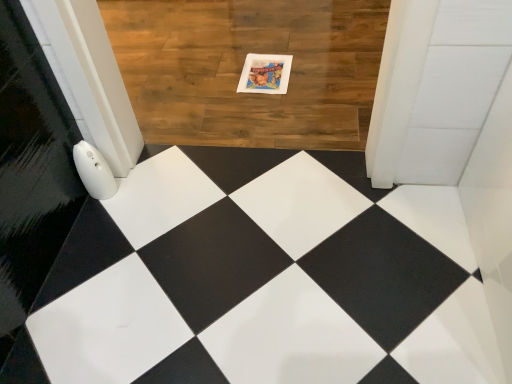
Question: Is point (381, 34) closer or farther from the camera than point (253, 72)?

Choices:
 (A) closer
 (B) farther

Answer: (B)

Question: Looking at the image, does wooden floor at center seem bigger or smaller compared to matte paper postcard at center?

Choices:
 (A) big
 (B) small

Answer: (A)

Question: Is wooden floor at center spatially inside matte paper postcard at center, or outside of it?

Choices:
 (A) inside
 (B) outside

Answer: (B)

Question: Is matte paper postcard at center bigger or smaller than wooden floor at center?

Choices:
 (A) small
 (B) big

Answer: (A)

Question: In terms of height, does matte paper postcard at center look taller or shorter compared to wooden floor at center?

Choices:
 (A) short
 (B) tall

Answer: (A)

Question: From a real-world perspective, relative to wooden floor at center, is matte paper postcard at center vertically above or below?

Choices:
 (A) below
 (B) above

Answer: (B)

Question: Is matte paper postcard at center inside the boundaries of wooden floor at center, or outside?

Choices:
 (A) outside
 (B) inside

Answer: (B)